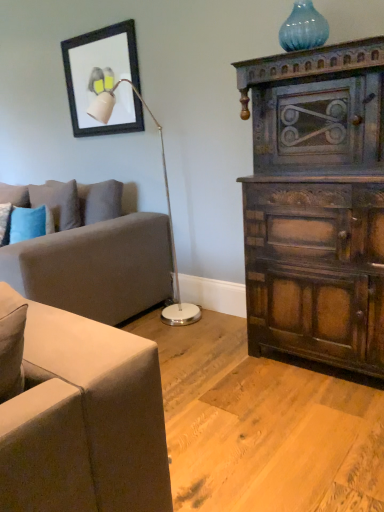
This screenshot has width=384, height=512. What are the coordinates of `vacant area that lies to the right of white glossy floor lamp at upper left` in the screenshot? It's located at (216, 328).